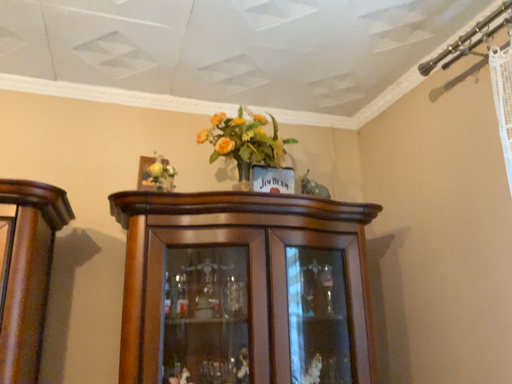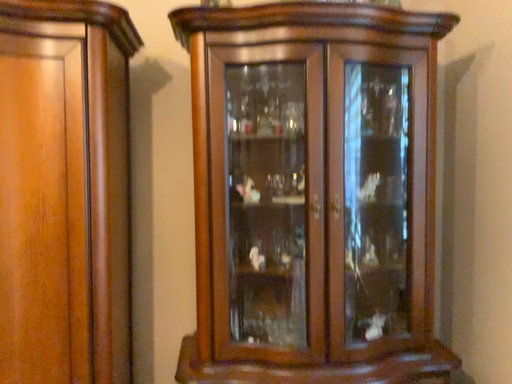
Question: Which way did the camera rotate in the video?

Choices:
 (A) rotated left
 (B) rotated right

Answer: (A)